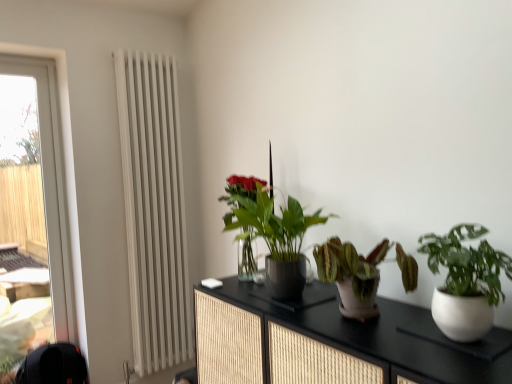
Question: Is leathery terracotta pot at center, the second houseplant positioned from the front, spatially inside black textured cabinet at center, or outside of it?

Choices:
 (A) outside
 (B) inside

Answer: (A)

Question: Is leathery terracotta pot at center, the second houseplant positioned from the front, bigger or smaller than black textured cabinet at center?

Choices:
 (A) big
 (B) small

Answer: (B)

Question: Which object is positioned closest to the white matte pot at right, the 1th houseplant from the front?

Choices:
 (A) green glossy plant at center, the first houseplant in the back-to-front sequence
 (B) green matte plant at center, the third houseplant viewed from the front
 (C) black textured cabinet at center
 (D) black fabric swivel chair at lower left
 (E) transparent glass window at left

Answer: (C)

Question: Based on their relative distances, which object is farther from the black fabric swivel chair at lower left?

Choices:
 (A) white metallic radiator at left
 (B) leathery terracotta pot at center, the second houseplant positioned from the front
 (C) green matte plant at center, which appears as the 2th houseplant when viewed from the back
 (D) black textured cabinet at center
 (E) green glossy plant at center, the first houseplant in the back-to-front sequence

Answer: (B)